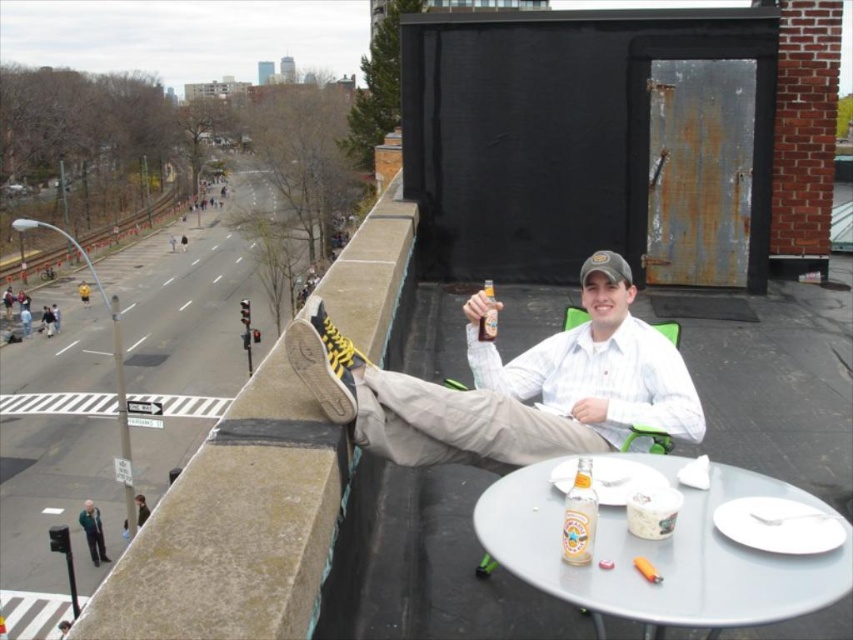
You are a delivery person who needs to place a package on the metallic gray table at center. However, there is a green fabric jacket at lower left nearby. Which object should you avoid placing the package on because it is shorter?

You should avoid placing the package on the metallic gray table at center because it is shorter than the green fabric jacket at lower left.

You are standing on a rooftop and want to place a small potted plant. The brown concrete ledge at upper left is the best spot. What are the coordinates for placing it?

The coordinates for placing the small potted plant on the brown concrete ledge at upper left are point [235,525].